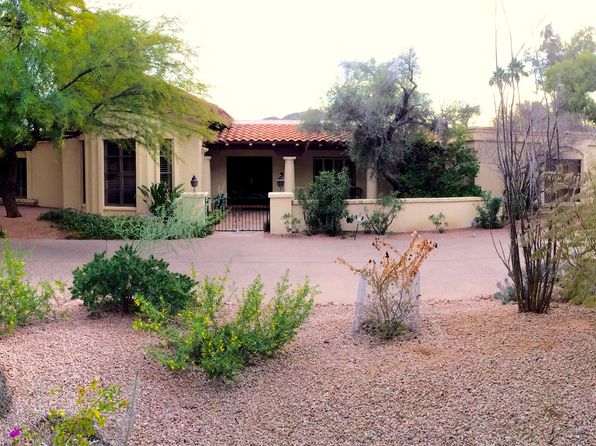
The height and width of the screenshot is (446, 596). I want to click on window far left, so click(23, 171).